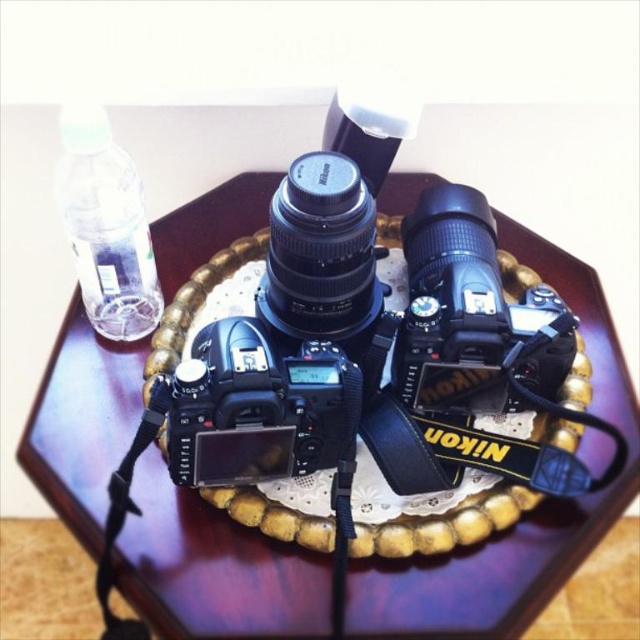
Question: Can you confirm if wooden tray at center is bigger than clear plastic bottle at upper left?

Choices:
 (A) yes
 (B) no

Answer: (A)

Question: Which object is the farthest from the clear plastic bottle at upper left?

Choices:
 (A) black matte digital camera at center
 (B) wooden tray at center
 (C) black matte camera at center

Answer: (C)

Question: Among these objects, which one is farthest from the camera?

Choices:
 (A) clear plastic bottle at upper left
 (B) wooden tray at center

Answer: (A)

Question: Does black matte digital camera at center appear on the right side of clear plastic bottle at upper left?

Choices:
 (A) no
 (B) yes

Answer: (B)

Question: Based on their relative distances, which object is nearer to the black matte camera at center?

Choices:
 (A) clear plastic bottle at upper left
 (B) wooden tray at center
 (C) black matte digital camera at center

Answer: (B)

Question: Can you confirm if black matte camera at center is bigger than black matte digital camera at center?

Choices:
 (A) yes
 (B) no

Answer: (A)